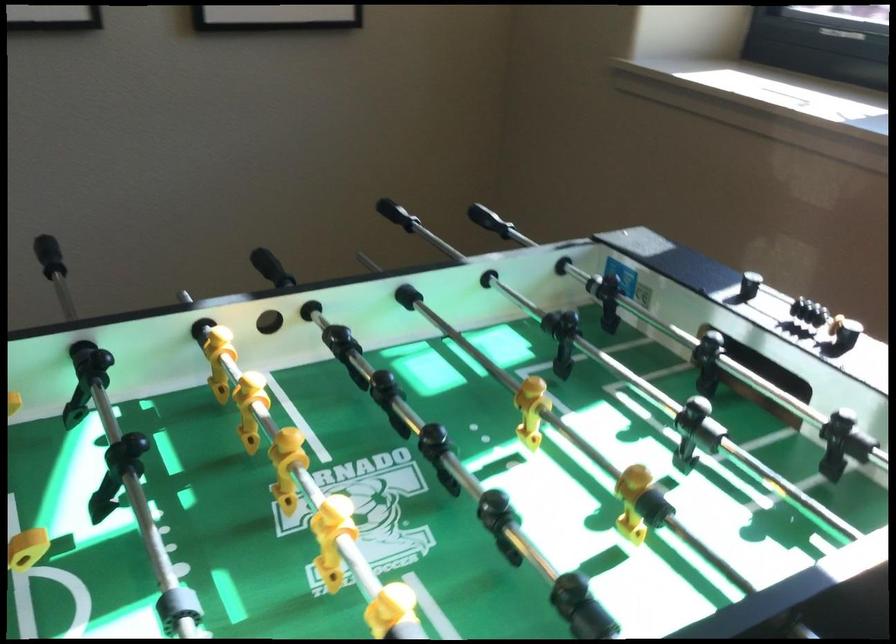
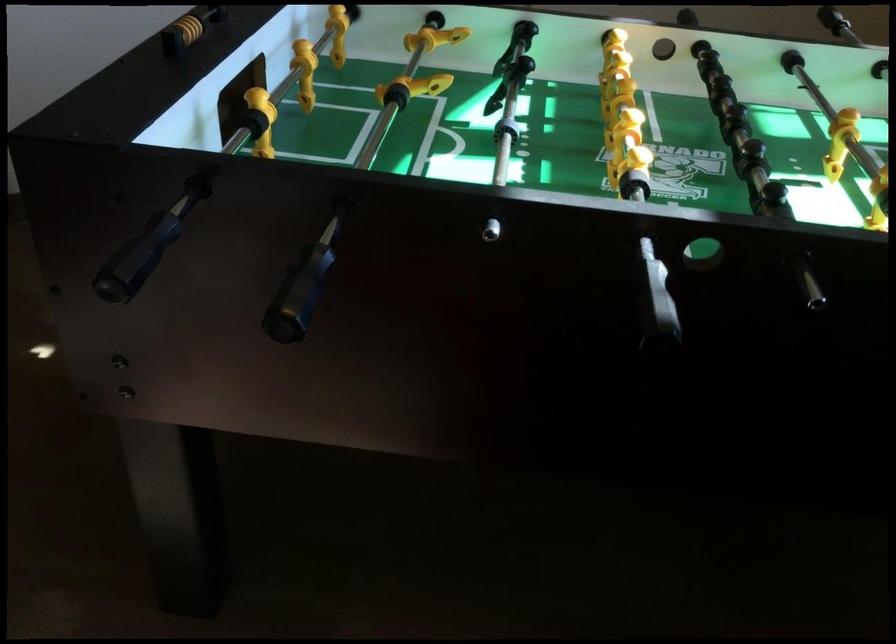
Question: The first image is from the beginning of the video and the second image is from the end. How did the camera likely rotate when shooting the video?

Choices:
 (A) Left
 (B) Right
 (C) Up
 (D) Down

Answer: (A)